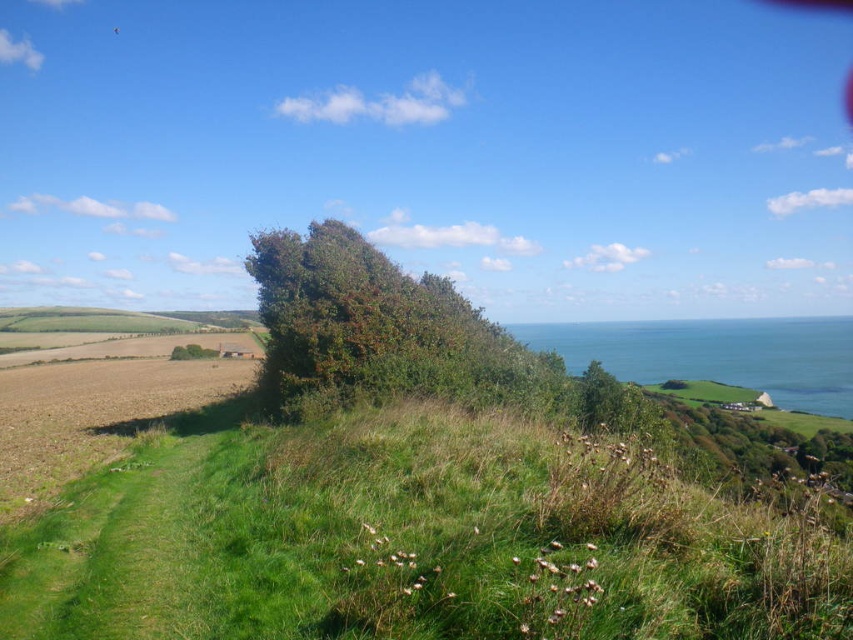
Is point (267, 588) positioned in front of point (347, 339)?

That is True.

Between green grassy hillside at center and green leafy bush at center, which one has less height?

green grassy hillside at center

At what (x,y) coordinates should I click in order to perform the action: click on green grassy hillside at center. Please return your answer as a coordinate pair (x, y). This screenshot has width=853, height=640. Looking at the image, I should click on (416, 540).